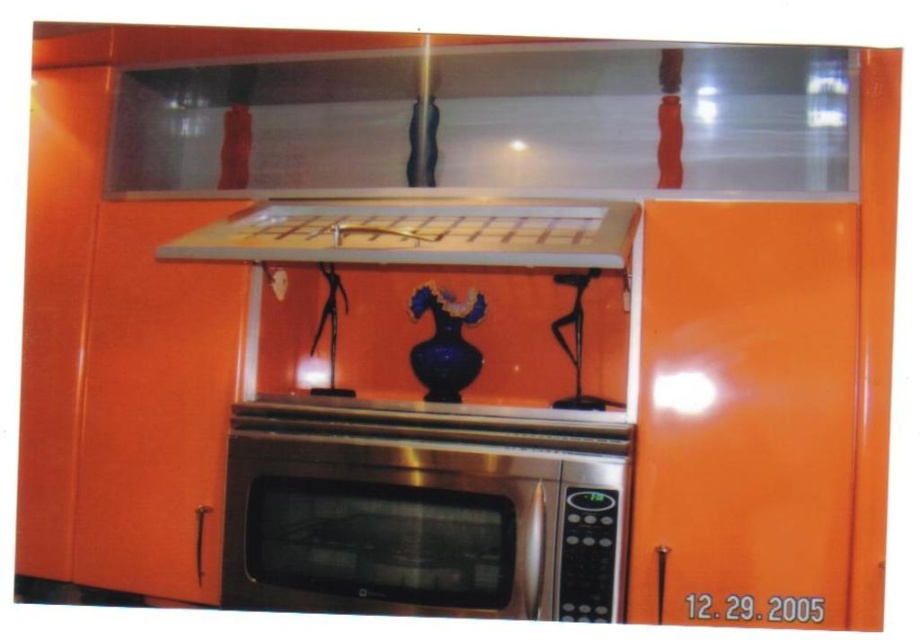
Question: Which object appears farthest from the camera in this image?

Choices:
 (A) stainless steel microwave at center
 (B) blue glass vase at center

Answer: (B)

Question: Can you confirm if stainless steel microwave at center is smaller than matte white exhaust hood at upper center?

Choices:
 (A) no
 (B) yes

Answer: (B)

Question: Among these points, which one is farthest from the camera?

Choices:
 (A) (325, 522)
 (B) (434, 294)
 (C) (384, 236)

Answer: (B)

Question: In this image, where is stainless steel microwave at center located relative to matte white exhaust hood at upper center?

Choices:
 (A) below
 (B) above

Answer: (A)

Question: Is stainless steel microwave at center wider than blue glass vase at center?

Choices:
 (A) yes
 (B) no

Answer: (A)

Question: Which point appears closest to the camera in this image?

Choices:
 (A) (460, 508)
 (B) (554, 218)
 (C) (468, 317)

Answer: (A)